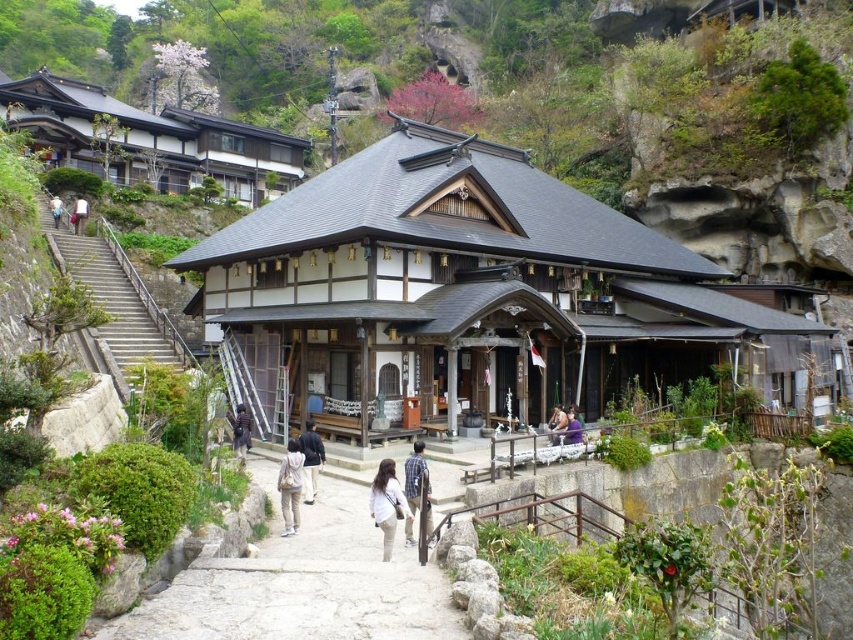
Can you confirm if light brown fabric pants at center is positioned above white cotton shirt at upper left?

No, light brown fabric pants at center is not above white cotton shirt at upper left.

Between point (401, 493) and point (57, 216), which one is positioned in front?

Point (401, 493) is more forward.

Image resolution: width=853 pixels, height=640 pixels. What do you see at coordinates (387, 504) in the screenshot? I see `light brown fabric pants at center` at bounding box center [387, 504].

You are a GUI agent. You are given a task and a screenshot of the screen. Output one action in this format:
    pyautogui.click(x=<x>, y=<y>)
    Task: Click on the light brown fabric pants at center
    The width and height of the screenshot is (853, 640).
    Given the screenshot: What is the action you would take?
    pyautogui.click(x=387, y=504)

Who is more forward, (236, 250) or (558, 428)?

Point (558, 428) is in front.

Can you confirm if wooden shrine at center is wider than light brown wooden chair at center?

Correct, the width of wooden shrine at center exceeds that of light brown wooden chair at center.

Where is `wooden shrine at center`? This screenshot has height=640, width=853. wooden shrine at center is located at coordinates (471, 292).

Looking at this image, does stone paved path at center have a lesser width compared to white fabric bag at upper left?

No, stone paved path at center is not thinner than white fabric bag at upper left.

Can you confirm if stone paved path at center is taller than white fabric bag at upper left?

Yes.

Identify the location of stone paved path at center. This screenshot has height=640, width=853. (302, 586).